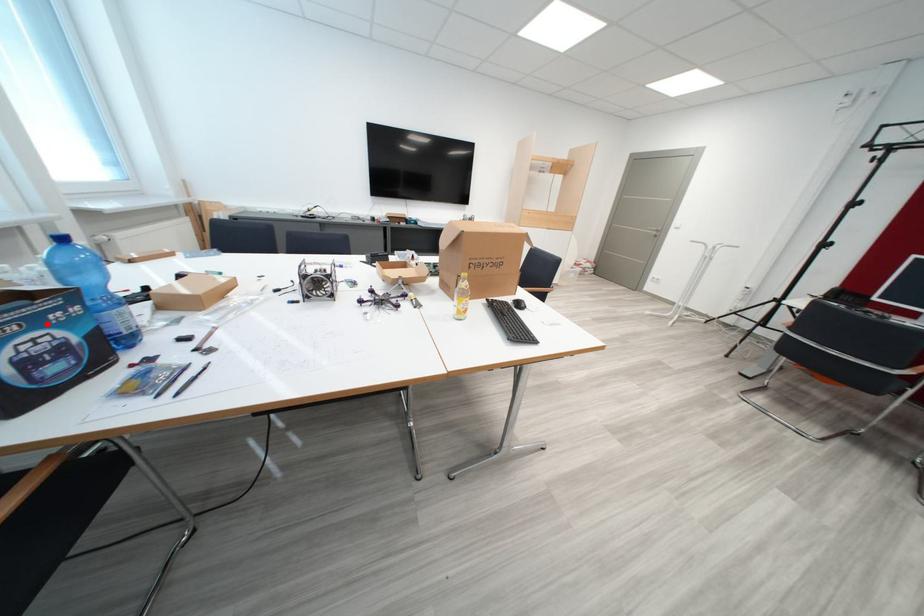
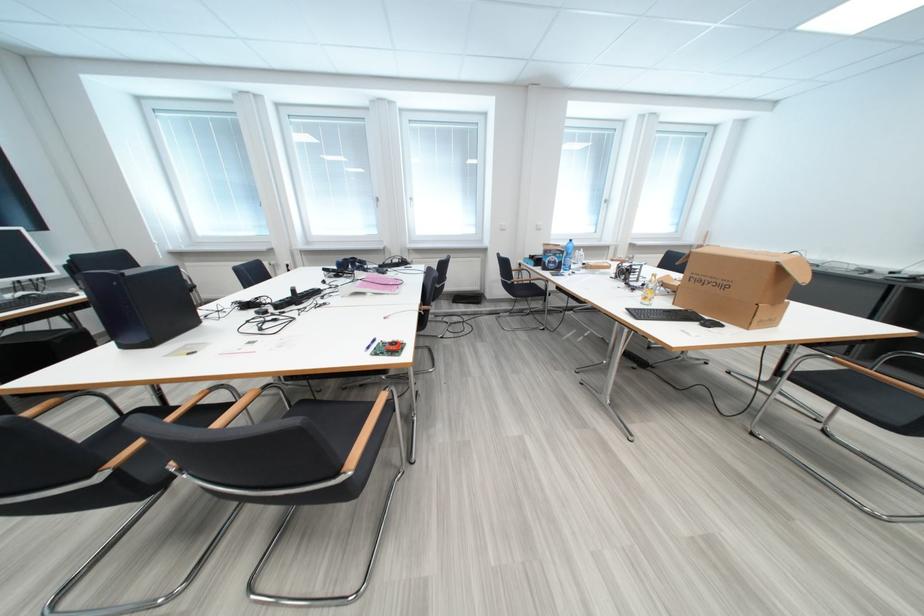
Question: A red point is marked in image1. In image2, is the corresponding 3D point closer to the camera or farther? Reply with the corresponding letter.

Choices:
 (A) The corresponding 3D point is closer.
 (B) The corresponding 3D point is farther.

Answer: (A)